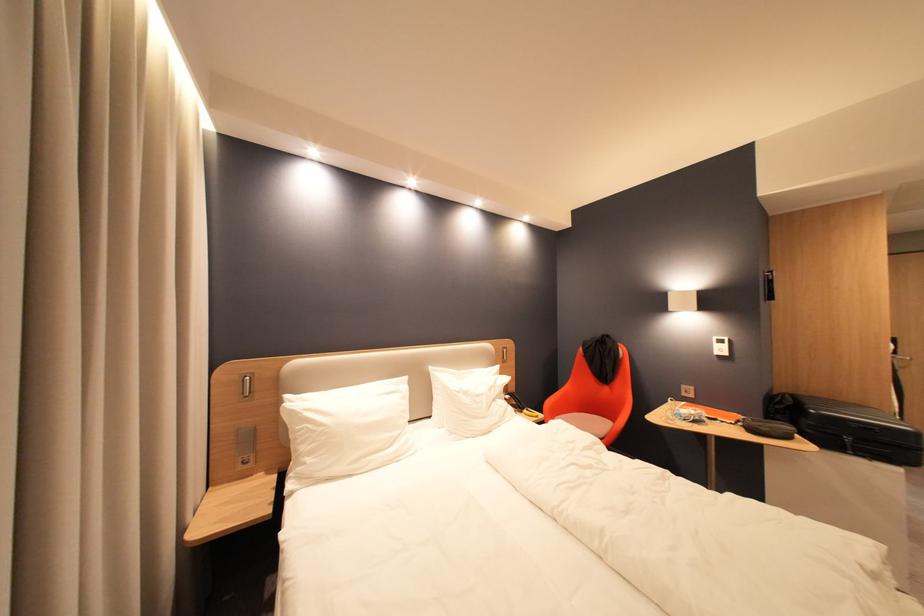
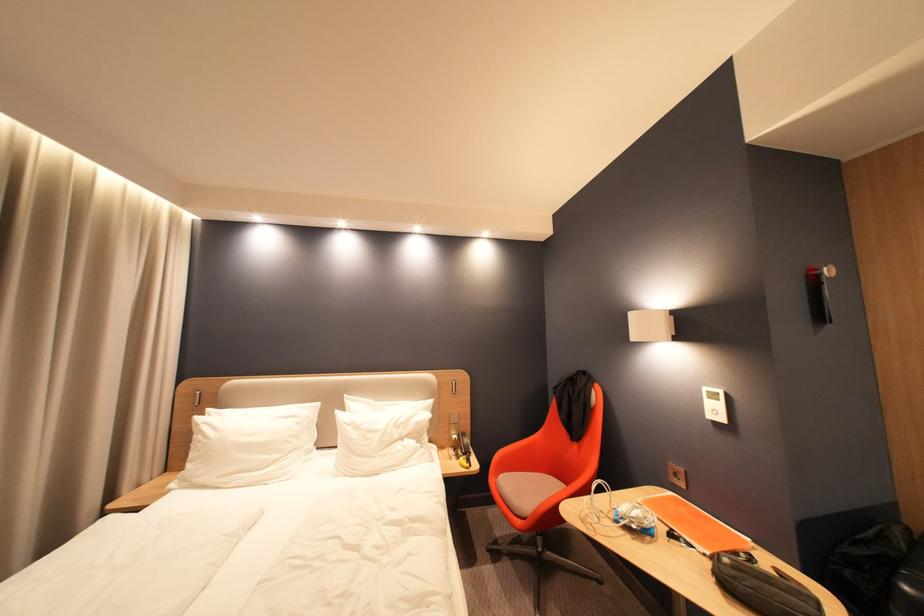
Find the pixel in the second image that matches pixel 468 391 in the first image.

(359, 424)